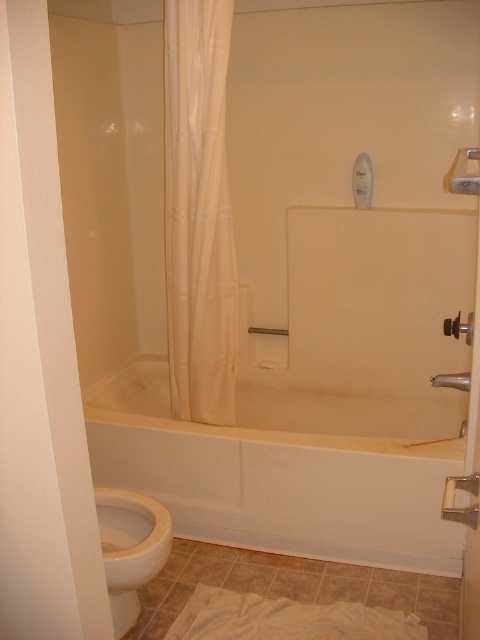
Question: Is white glossy toilet bowl at lower left positioned behind matte white shower at right?

Choices:
 (A) no
 (B) yes

Answer: (B)

Question: Estimate the real-world distances between objects in this image. Which object is farther from the matte white shower at right?

Choices:
 (A) white glossy toilet bowl at lower left
 (B) white fabric shower curtain at left

Answer: (A)

Question: Can you confirm if white glossy bathtub at center is wider than white glossy toilet bowl at lower left?

Choices:
 (A) yes
 (B) no

Answer: (A)

Question: Is white fabric shower curtain at left below white glossy toilet bowl at lower left?

Choices:
 (A) no
 (B) yes

Answer: (A)

Question: Among these points, which one is nearest to the camera?

Choices:
 (A) (169, 355)
 (B) (460, 374)

Answer: (B)

Question: Considering the real-world distances, which object is farthest from the white fabric shower curtain at left?

Choices:
 (A) matte white shower at right
 (B) white glossy bathtub at center

Answer: (A)